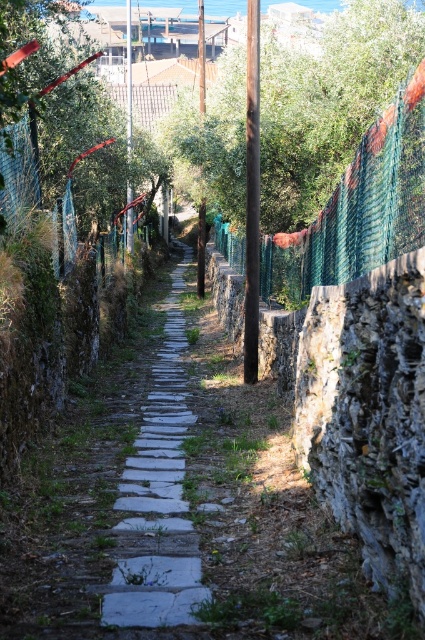
Which is more to the left, green mesh fence at center or white stone path at center?

Positioned to the left is white stone path at center.

Is green mesh fence at center below white stone path at center?

Incorrect, green mesh fence at center is not positioned below white stone path at center.

Is point (374, 172) less distant than point (176, 291)?

Yes, it is in front of point (176, 291).

Find the location of a particular element. green mesh fence at center is located at coordinates (359, 209).